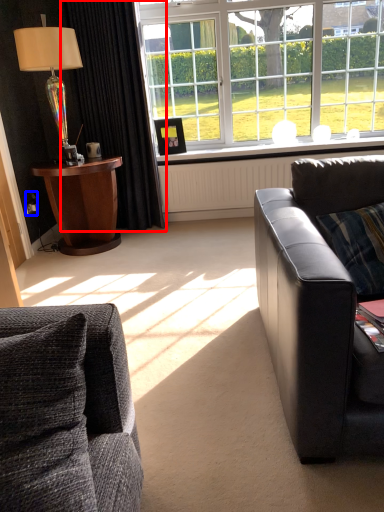
Question: Which object is further to the camera taking this photo, curtain (highlighted by a red box) or power outlet (highlighted by a blue box)?

Choices:
 (A) curtain
 (B) power outlet

Answer: (B)